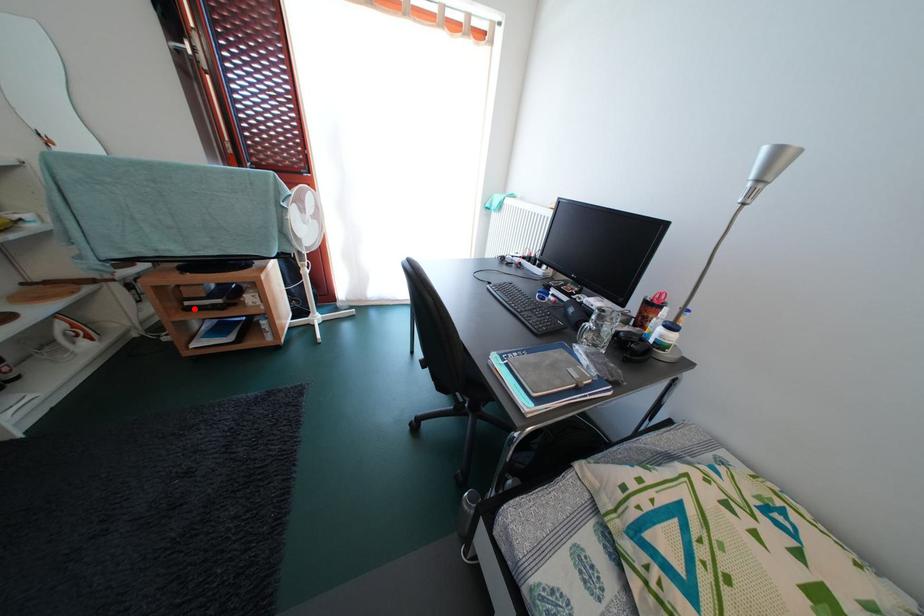
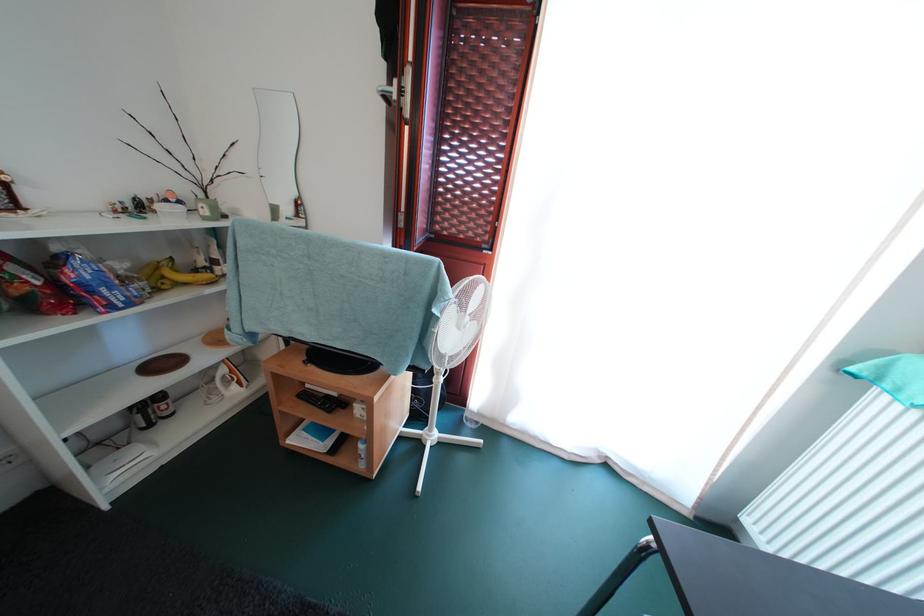
The point at the highlighted location is marked in the first image. Where is the corresponding point in the second image?

(314, 391)